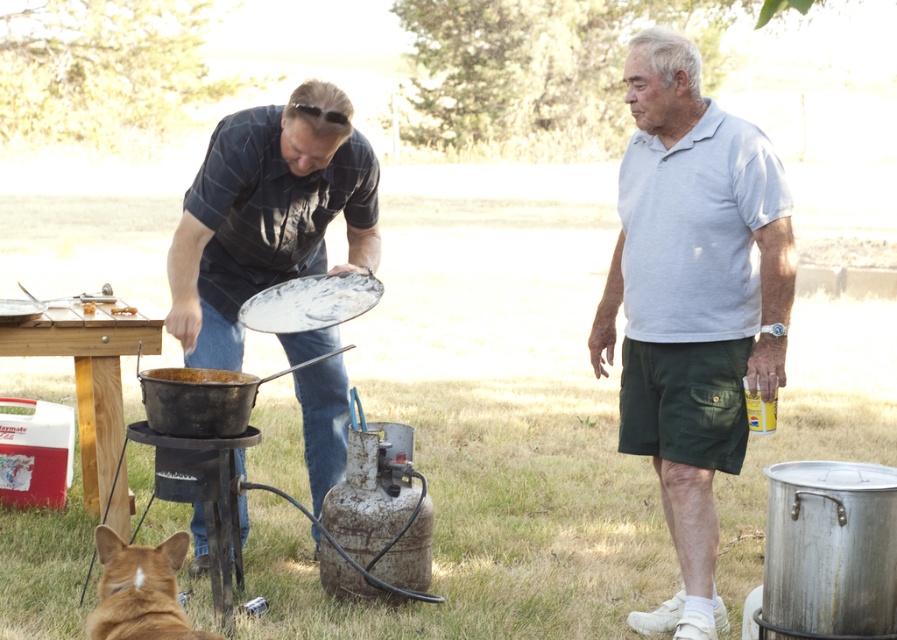
In the scene shown: You are a person who wants to grab the rusty metal pot at lower left from where you are standing next to the dark blue plaid shirt at center. Is the pot within arm reach?

The distance between the dark blue plaid shirt at center and the rusty metal pot at lower left is 13.65 inches, so yes, the pot is within arm reach.

You are planning to set up a small campfire in this scene. You have a portable grill and a pot that you need to place near the fire. Given the space between the rusty metal barbecue grill at lower left and the rusty metal pot at lower left, would there be enough room to safely place both items around the fire without them being too close to each other?

The rusty metal barbecue grill at lower left and the rusty metal pot at lower left are 11.34 inches apart. This distance may be sufficient for safe placement around a campfire, but it ultimately depends on local fire safety guidelines and the specific size of your grill and pot. Always ensure adequate clearance between heat sources and flammable items.